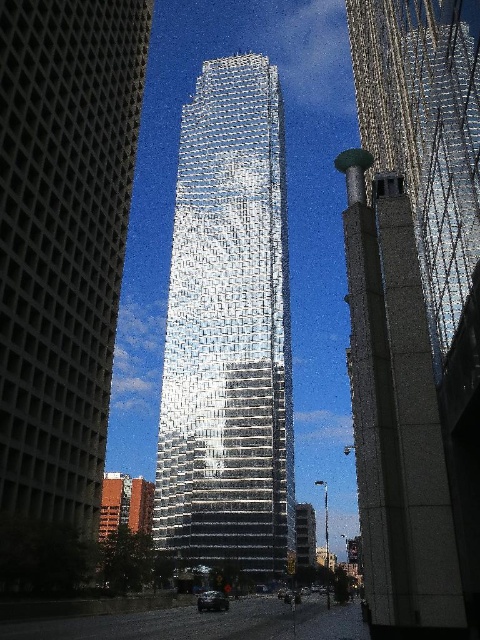
You are a city planner assessing the skyline. Which of the two buildings, the reflective glass tower at center or the reflective glass skyscraper at right, would cast a longer shadow during midday when the sun is directly overhead?

The reflective glass tower at center is larger in size than the reflective glass skyscraper at right, so it would cast a longer shadow during midday when the sun is directly overhead.

You are standing at the point marked by the coordinates point (228, 330) in the image. Which object are you closest to?

The point (228, 330) indicates reflective glass tower at center, so you are closest to the reflective glass tower at center.